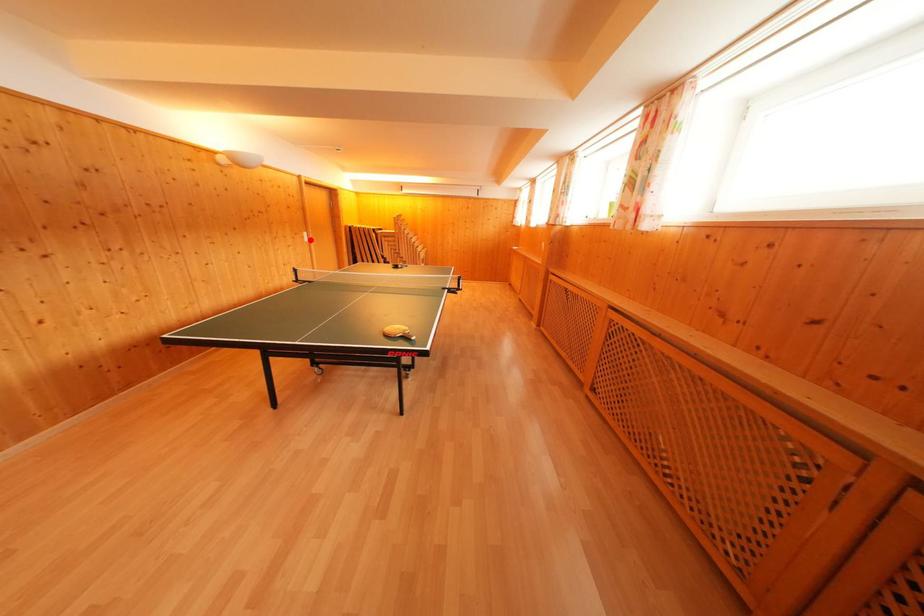
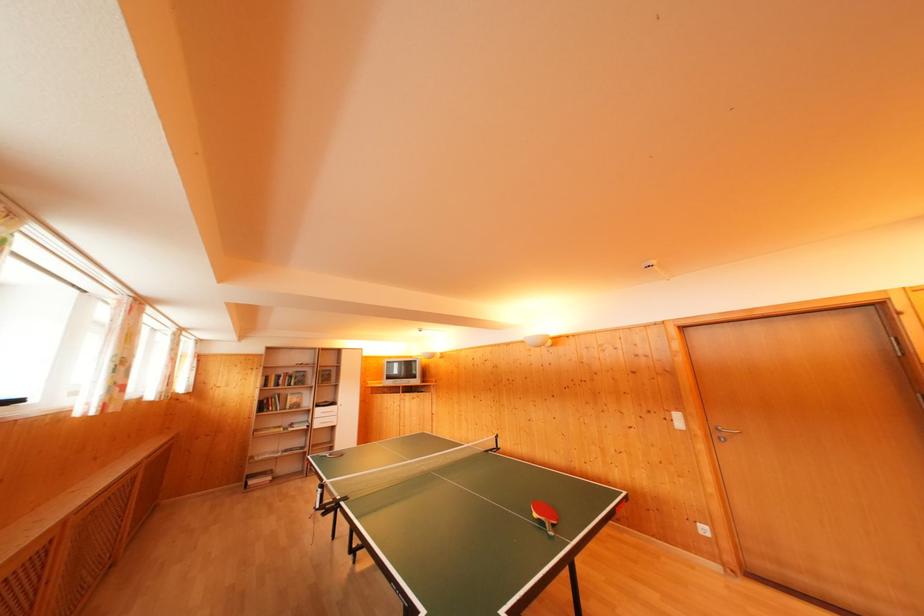
Question: I am providing you with two images of the same scene from different viewpoints. Image1 has a red point marked. In image2, the corresponding 3D location appears at what relative position? Reply with the corresponding letter.

Choices:
 (A) Closer
 (B) Farther

Answer: (B)